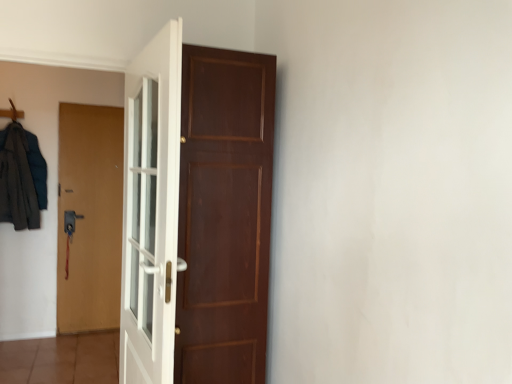
Question: Which direction should I rotate to look at brown wooden door at center, arranged as the first door when viewed from the right, — up or down?

Choices:
 (A) up
 (B) down

Answer: (B)

Question: Can you confirm if dark gray fabric coat at left is bigger than brown matte door at left, acting as the third door starting from the right?

Choices:
 (A) no
 (B) yes

Answer: (A)

Question: Is the surface of dark gray fabric coat at left in direct contact with brown matte door at left, which is the third door from front to back?

Choices:
 (A) no
 (B) yes

Answer: (A)

Question: Would you say dark gray fabric coat at left is outside brown matte door at left, which is the third door from front to back?

Choices:
 (A) yes
 (B) no

Answer: (A)

Question: Can you confirm if dark gray fabric coat at left is taller than brown matte door at left, acting as the 1th door starting from the left?

Choices:
 (A) yes
 (B) no

Answer: (B)

Question: Does dark gray fabric coat at left have a greater width compared to brown matte door at left, which is the third door from front to back?

Choices:
 (A) yes
 (B) no

Answer: (A)

Question: Does dark gray fabric coat at left appear on the right side of brown matte door at left, which is the 1th door from back to front?

Choices:
 (A) no
 (B) yes

Answer: (A)

Question: Is white glossy door at center, which appears as the first door when viewed from the front, shorter than dark gray fabric coat at left?

Choices:
 (A) no
 (B) yes

Answer: (A)

Question: From a real-world perspective, is white glossy door at center, which ranks as the 2th door in right-to-left order, positioned under dark gray fabric coat at left based on gravity?

Choices:
 (A) no
 (B) yes

Answer: (B)

Question: From the image's perspective, does white glossy door at center, arranged as the third door when viewed from the back, appear lower than dark gray fabric coat at left?

Choices:
 (A) no
 (B) yes

Answer: (B)

Question: Does white glossy door at center, which ranks as the 2th door in right-to-left order, lie behind dark gray fabric coat at left?

Choices:
 (A) no
 (B) yes

Answer: (A)

Question: From the image's perspective, is white glossy door at center, the 2th door in the left-to-right sequence, located above dark gray fabric coat at left?

Choices:
 (A) yes
 (B) no

Answer: (B)

Question: Could dark gray fabric coat at left be considered to be inside white glossy door at center, which ranks as the 2th door in right-to-left order?

Choices:
 (A) no
 (B) yes

Answer: (A)

Question: Is wooden hanger at upper left not close to dark gray fabric coat at left?

Choices:
 (A) yes
 (B) no

Answer: (B)